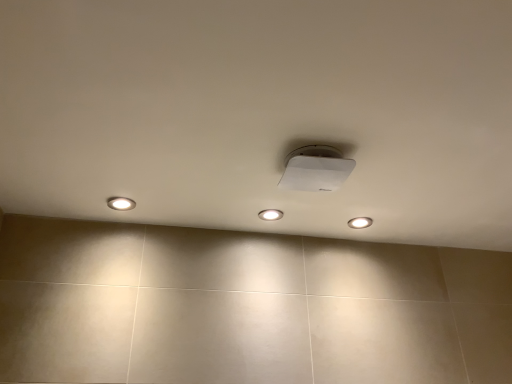
Question: Considering the positions of white glossy light fixture at upper center, acting as the 3th dot starting from the front, and matte white light at left, the third dot when ordered from back to front, in the image, is white glossy light fixture at upper center, acting as the 3th dot starting from the front, taller or shorter than matte white light at left, the third dot when ordered from back to front,?

Choices:
 (A) short
 (B) tall

Answer: (A)

Question: Looking at their shapes, would you say white glossy light fixture at upper center, which is the first dot in right-to-left order, is wider or thinner than matte white light at left, the third dot when ordered from back to front?

Choices:
 (A) wide
 (B) thin

Answer: (B)

Question: Estimate the real-world distances between objects in this image. Which object is farther from the matte white light at left, acting as the first dot starting from the left?

Choices:
 (A) white glossy light fixture at upper center, which appears as the third dot when viewed from the left
 (B) white plastic lamp at center
 (C) white glossy light fixture at center, arranged as the second dot when viewed from the front

Answer: (A)

Question: Which is nearer to the white plastic lamp at center?

Choices:
 (A) white glossy light fixture at upper center, which is the first dot in right-to-left order
 (B) matte white light at left, which is counted as the 1th dot, starting from the front
 (C) white glossy light fixture at center, acting as the second dot starting from the left

Answer: (C)